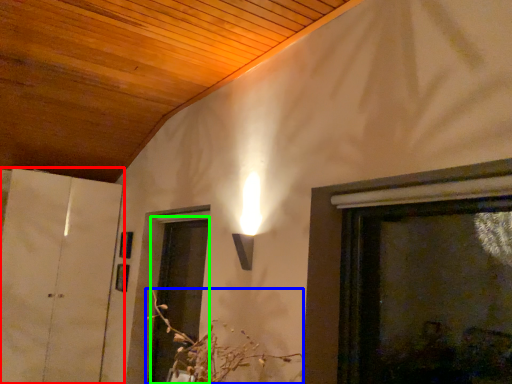
Question: Estimate the real-world distances between objects in this image. Which object is farther from door (highlighted by a red box), flower (highlighted by a blue box) or screen door (highlighted by a green box)?

Choices:
 (A) flower
 (B) screen door

Answer: (A)